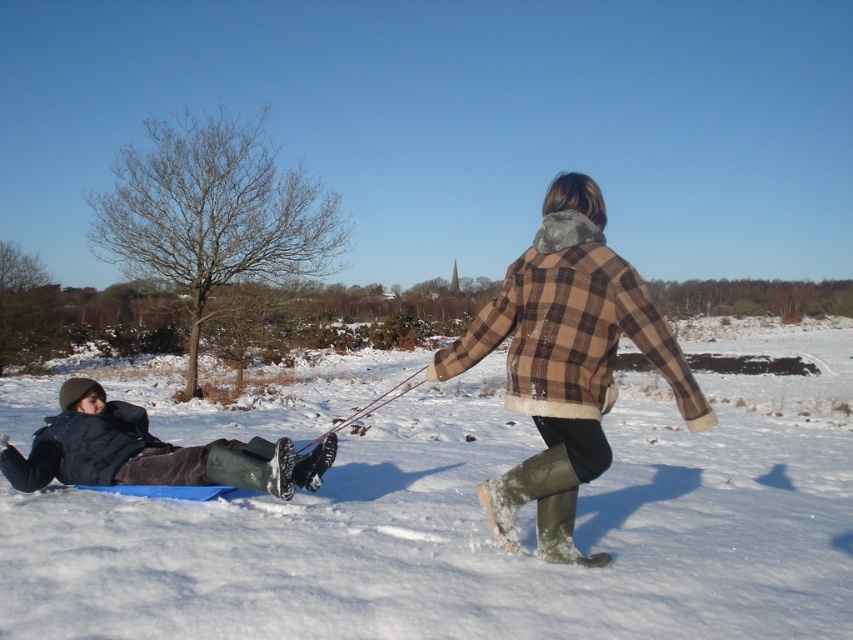
Question: Can you confirm if plaid woolen coat at center is positioned to the left of dark blue fabric at lower left?

Choices:
 (A) no
 (B) yes

Answer: (A)

Question: Can you confirm if plaid woolen coat at center is bigger than dark blue fabric at lower left?

Choices:
 (A) yes
 (B) no

Answer: (A)

Question: Estimate the real-world distances between objects in this image. Which object is closer to the dark blue fabric at lower left?

Choices:
 (A) white fluffy snow at center
 (B) plaid woolen coat at center

Answer: (B)

Question: Which of the following is the closest to the observer?

Choices:
 (A) (91, 451)
 (B) (635, 310)

Answer: (B)

Question: Which of the following is the farthest from the observer?

Choices:
 (A) (149, 483)
 (B) (619, 468)
 (C) (514, 486)

Answer: (B)

Question: Where is white fluffy snow at center located in relation to plaid woolen coat at center in the image?

Choices:
 (A) left
 (B) right

Answer: (A)